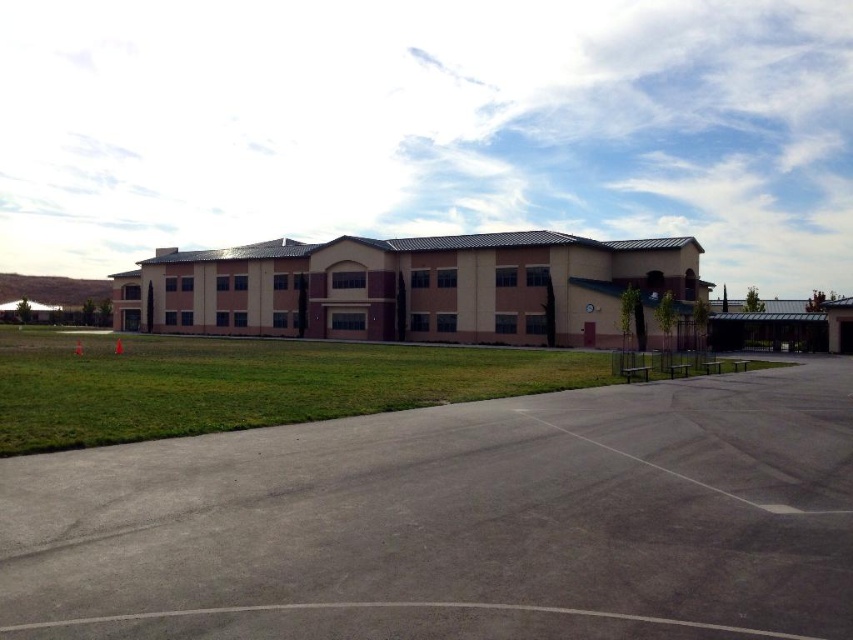
Which is above, beige stucco building at center or green grass at center?

beige stucco building at center

Which is behind, point (373, 246) or point (381, 348)?

The point (373, 246) is behind.

Identify the location of beige stucco building at center. The width and height of the screenshot is (853, 640). (410, 288).